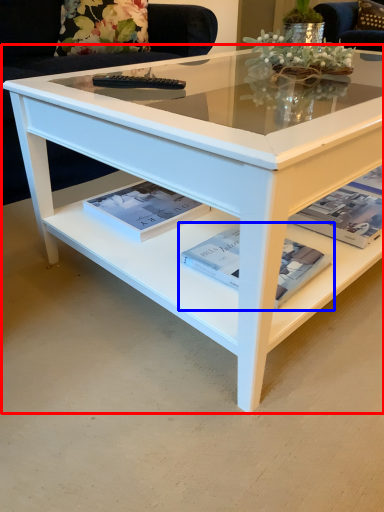
Question: Which of the following is the closest to the observer, coffee table (highlighted by a red box) or magazine (highlighted by a blue box)?

Choices:
 (A) coffee table
 (B) magazine

Answer: (A)